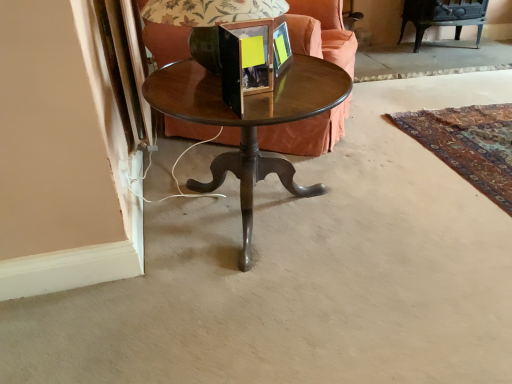
Question: Is matte black picture frame at upper center, the 2th picture frame positioned from the front, bigger or smaller than velvet orange couch at center?

Choices:
 (A) small
 (B) big

Answer: (A)

Question: Considering the positions of point (273, 36) and point (167, 33), is point (273, 36) closer or farther from the camera than point (167, 33)?

Choices:
 (A) closer
 (B) farther

Answer: (A)

Question: Estimate the real-world distances between objects in this image. Which object is farther from the matte black lampshade at center?

Choices:
 (A) velvet orange couch at center
 (B) matte black picture frame at upper center, marked as the first picture frame in a back-to-front arrangement
 (C) wooden picture frame at center, which is the 1th picture frame in front-to-back order
 (D) wooden round table at center

Answer: (A)

Question: Estimate the real-world distances between objects in this image. Which object is farther from the velvet orange couch at center?

Choices:
 (A) matte black picture frame at upper center, the 2th picture frame positioned from the front
 (B) wooden round table at center
 (C) matte black lampshade at center
 (D) wooden picture frame at center, which is the 1th picture frame in front-to-back order

Answer: (D)